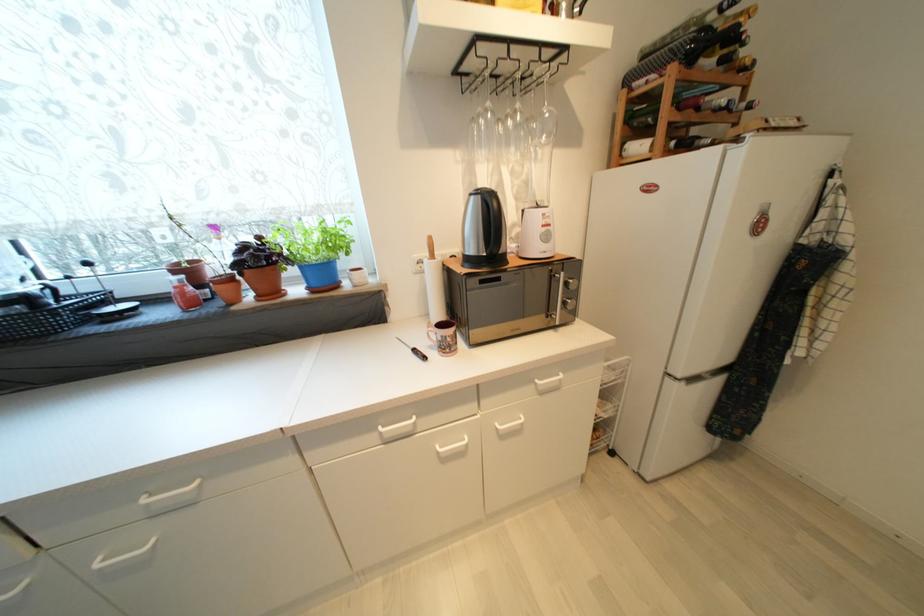
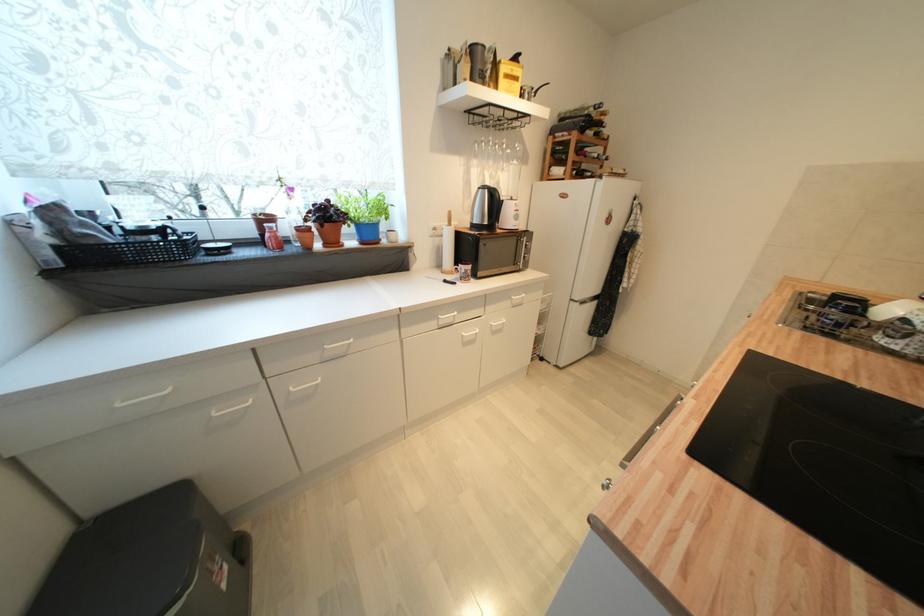
The point at (x=511, y=416) is marked in the first image. Where is the corresponding point in the second image?

(502, 318)